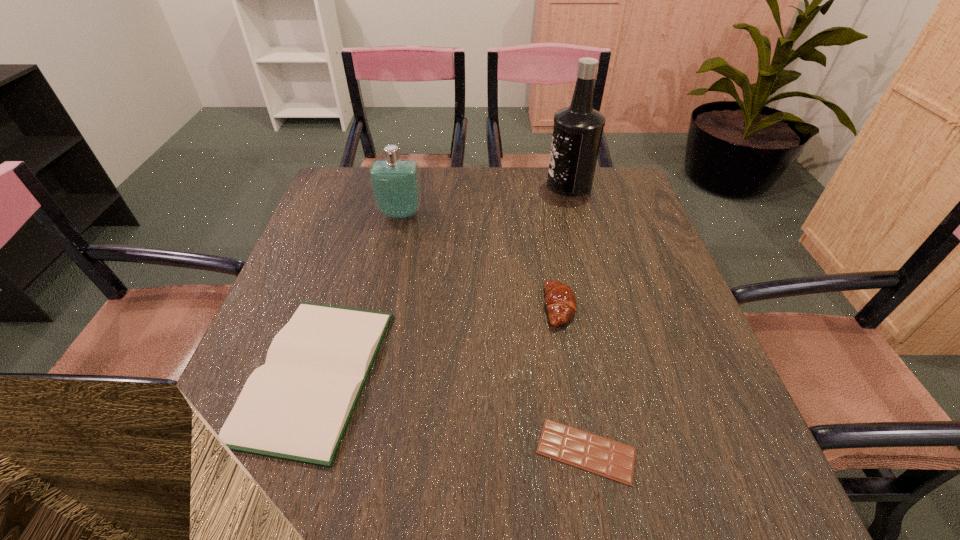
What are the coordinates of `free region that satisfies the following two spatial constraints: 1. on the front label of the liquor; 2. on the front side of the third shortest object` in the screenshot? It's located at (602, 307).

At what (x,y) coordinates should I click in order to perform the action: click on blank space that satisfies the following two spatial constraints: 1. on the front label of the second tallest object; 2. on the left side of the shortest object. Please return your answer as a coordinate pair (x, y). Looking at the image, I should click on pos(348,451).

The image size is (960, 540). In order to click on free space that satisfies the following two spatial constraints: 1. on the front label of the perfume; 2. on the right side of the crescent roll in this screenshot , I will do `click(380, 307)`.